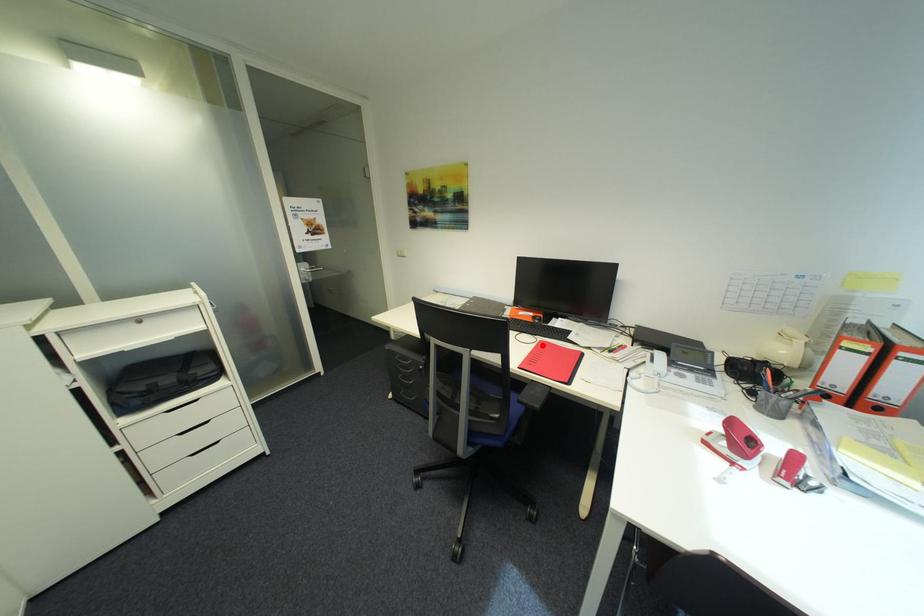
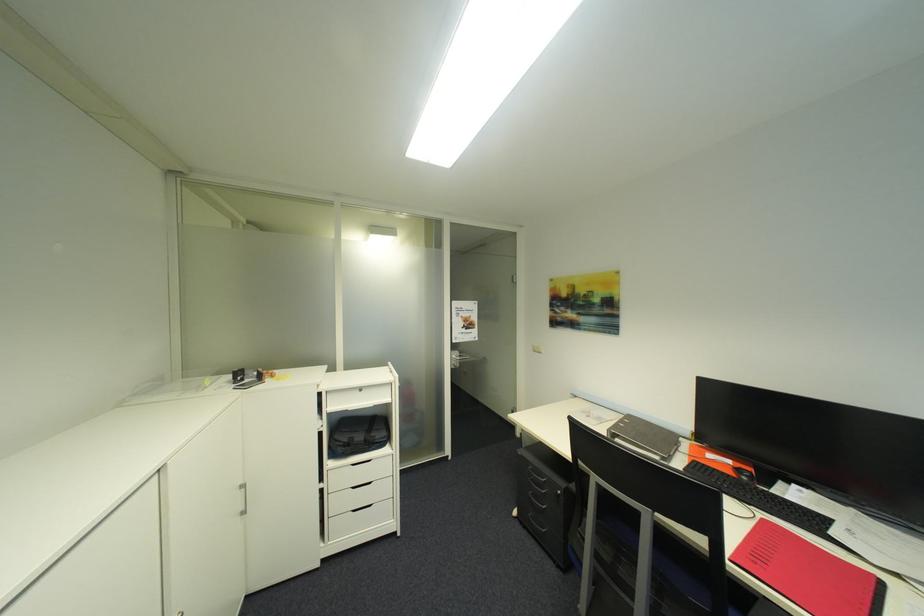
Question: I am providing you with two images of the same scene from different viewpoints. Given a red point in image1, look at the same physical point in image2. Is it:

Choices:
 (A) Closer to the viewpoint
 (B) Farther from the viewpoint

Answer: (A)